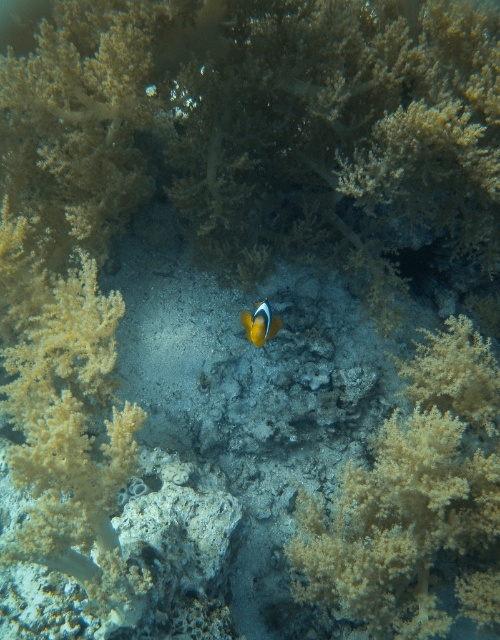
Question: Is soft yellow coral at left closer to the viewer compared to orange matte fish at center?

Choices:
 (A) no
 (B) yes

Answer: (B)

Question: Which point is farther from the camera taking this photo?

Choices:
 (A) (306, 579)
 (B) (276, 332)

Answer: (B)

Question: Is soft yellow coral at left positioned before orange matte fish at center?

Choices:
 (A) no
 (B) yes

Answer: (B)

Question: Which object is the farthest from the orange matte fish at center?

Choices:
 (A) translucent yellow coral at center
 (B) soft yellow coral at left

Answer: (A)

Question: Does soft yellow coral at left appear on the left side of orange matte fish at center?

Choices:
 (A) yes
 (B) no

Answer: (A)

Question: Considering the real-world distances, which object is closest to the soft yellow coral at left?

Choices:
 (A) translucent yellow coral at center
 (B) orange matte fish at center

Answer: (B)